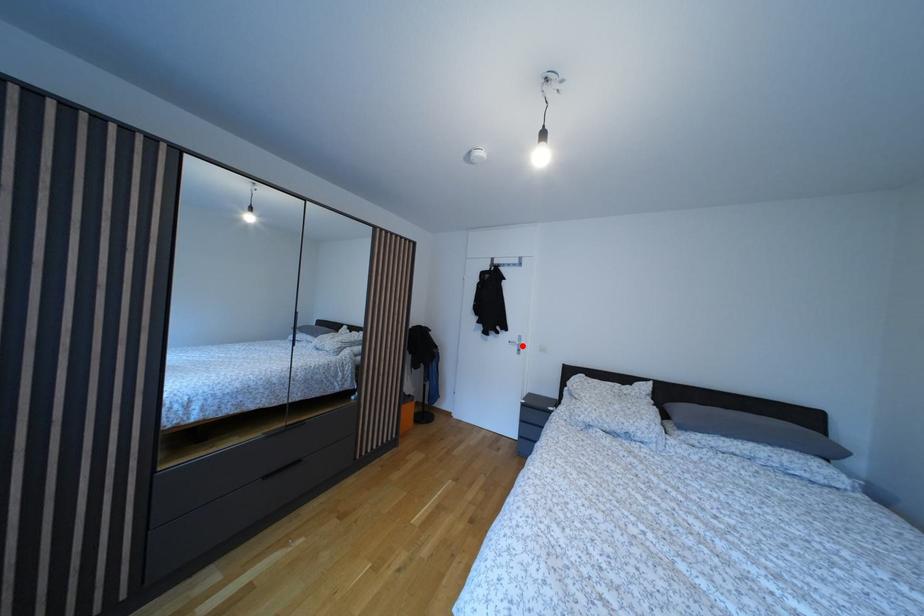
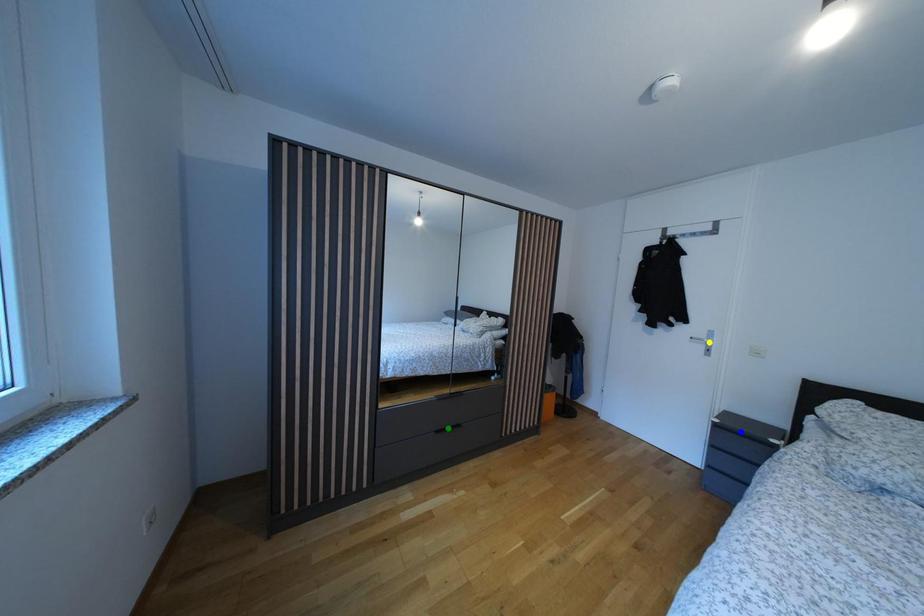
Question: I am providing you with two images of the same scene from different viewpoints. A red point is marked on the first image. You are given multiple points on the second image. In image 2, which mark is for the same physical point as the one in image 1?

Choices:
 (A) yellow point
 (B) blue point
 (C) green point

Answer: (A)